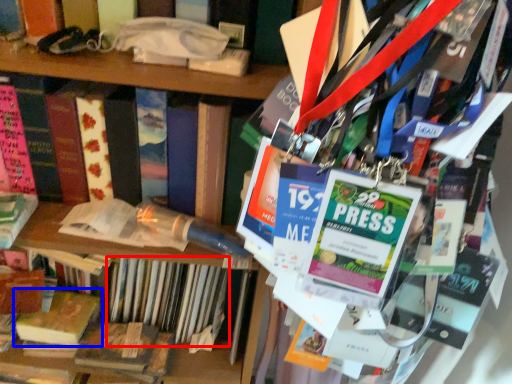
Question: Which object appears closest to the camera in this image, book (highlighted by a red box) or book (highlighted by a blue box)?

Choices:
 (A) book
 (B) book

Answer: (A)